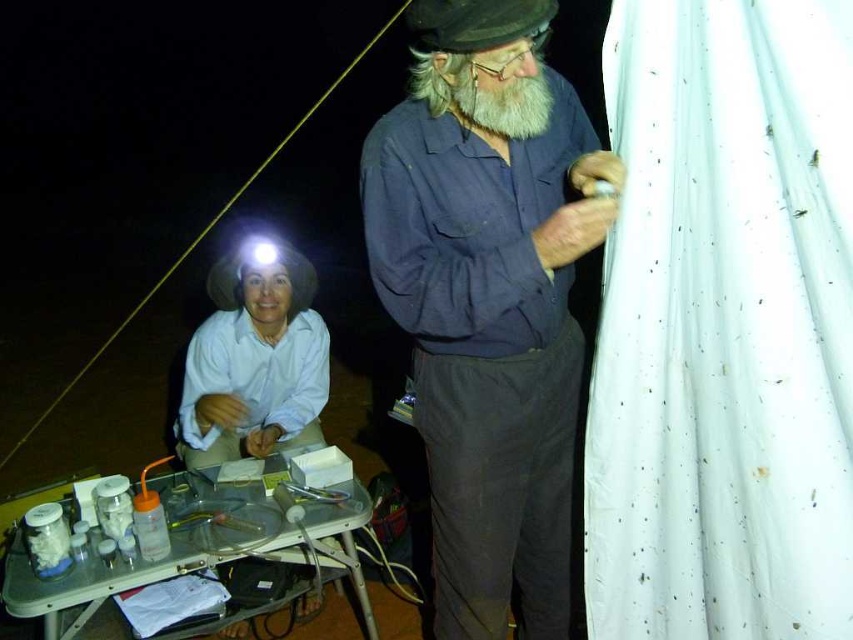
What do you see at coordinates (489, 300) in the screenshot?
I see `blue cotton shirt at center` at bounding box center [489, 300].

Which is above, blue cotton shirt at center or white matte hat at upper left?

white matte hat at upper left is above.

Locate an element on the screen. Image resolution: width=853 pixels, height=640 pixels. blue cotton shirt at center is located at coordinates (489, 300).

Find the location of `blue cotton shirt at center`. blue cotton shirt at center is located at coordinates (489, 300).